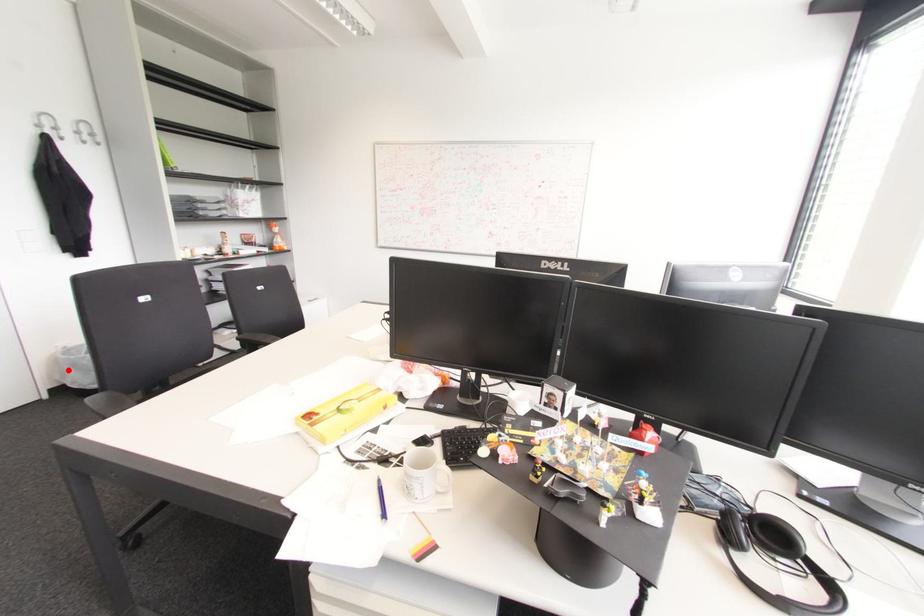
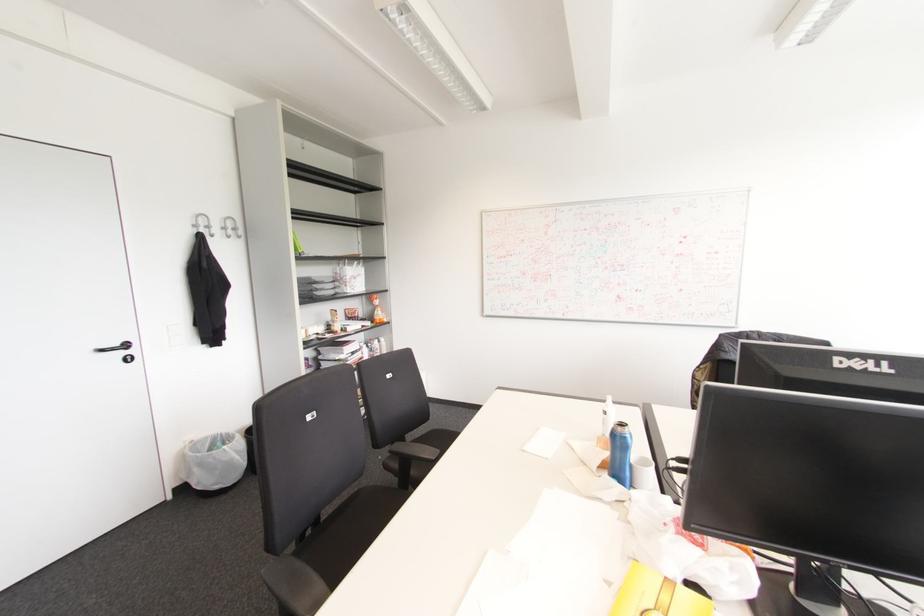
Find the pixel in the second image that matches the highlighted location in the first image.

(195, 469)